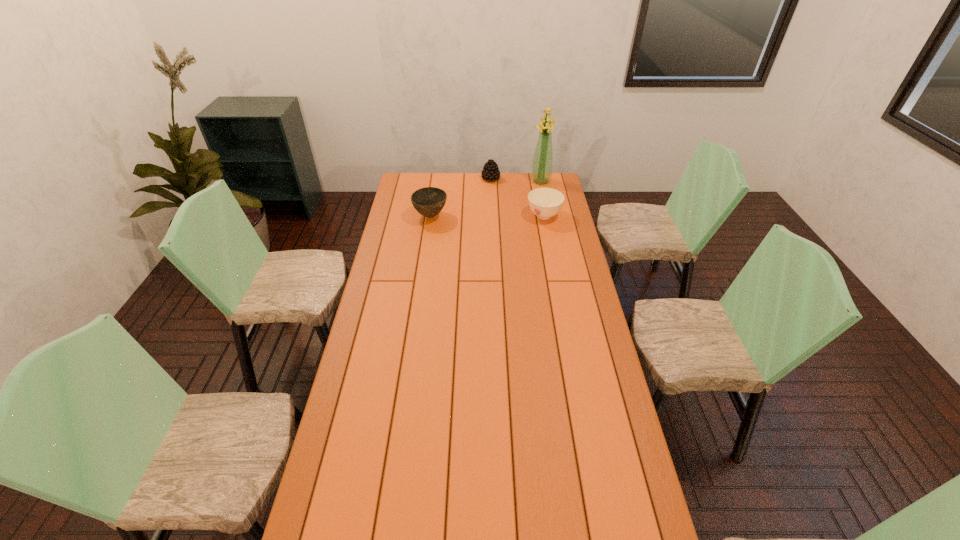
The width and height of the screenshot is (960, 540). Identify the location of vacant area that lies between the leftmost object and the second object from left to right. (461, 198).

The image size is (960, 540). I want to click on vacant space that's between the leftmost object and the second object from left to right, so click(x=461, y=198).

Locate an element on the screen. Image resolution: width=960 pixels, height=540 pixels. vacant space in between the pinecone and the sugar bowl is located at coordinates (517, 197).

The width and height of the screenshot is (960, 540). In order to click on vacant point located between the leftmost object and the pinecone in this screenshot , I will do `click(461, 198)`.

Locate which object ranks in proximity to the third object from right to left. Please provide its 2D coordinates. Your answer should be formatted as a tuple, i.e. [(x, y)], where the tuple contains the x and y coordinates of a point satisfying the conditions above.

[(541, 172)]

You are a GUI agent. You are given a task and a screenshot of the screen. Output one action in this format:
    pyautogui.click(x=<x>, y=<y>)
    Task: Click on the object that is the nearest to the third object from right to left
    Image resolution: width=960 pixels, height=540 pixels.
    Given the screenshot: What is the action you would take?
    pyautogui.click(x=541, y=172)

This screenshot has height=540, width=960. Identify the location of free space that satisfies the following two spatial constraints: 1. on the back side of the bowl; 2. on the right side of the bouquet. (436, 181).

At what (x,y) coordinates should I click in order to perform the action: click on vacant space that satisfies the following two spatial constraints: 1. on the back side of the bouquet; 2. on the left side of the sugar bowl. Please return your answer as a coordinate pair (x, y). Looking at the image, I should click on (538, 181).

I want to click on blank space that satisfies the following two spatial constraints: 1. on the back side of the sugar bowl; 2. on the left side of the bouquet, so click(x=538, y=181).